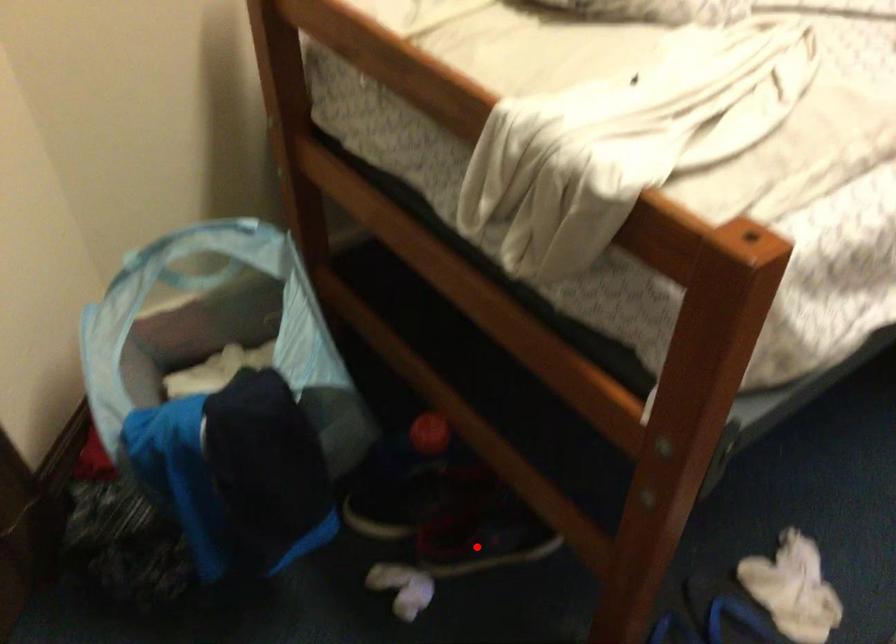
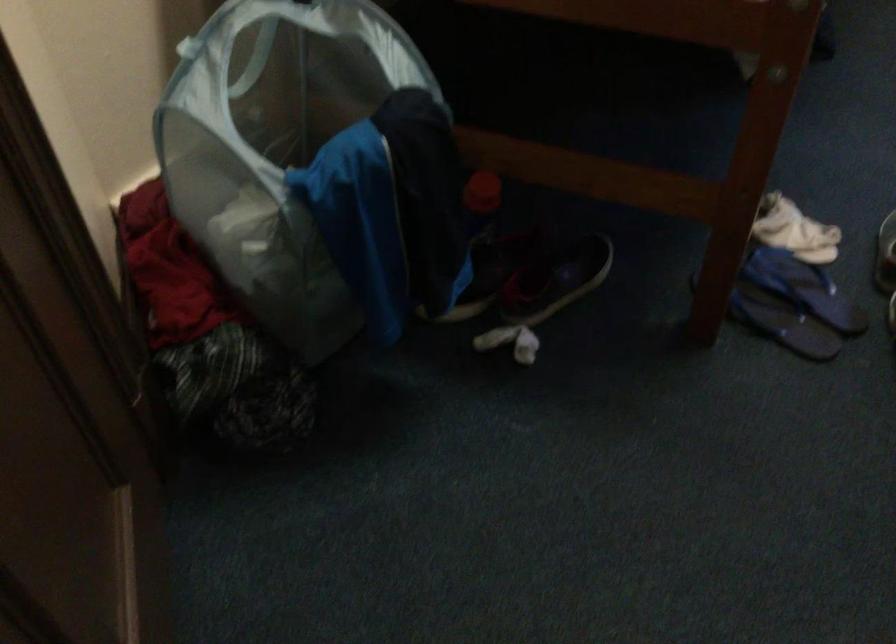
Where in the second image is the point corresponding to the highlighted location from the first image?

(556, 279)